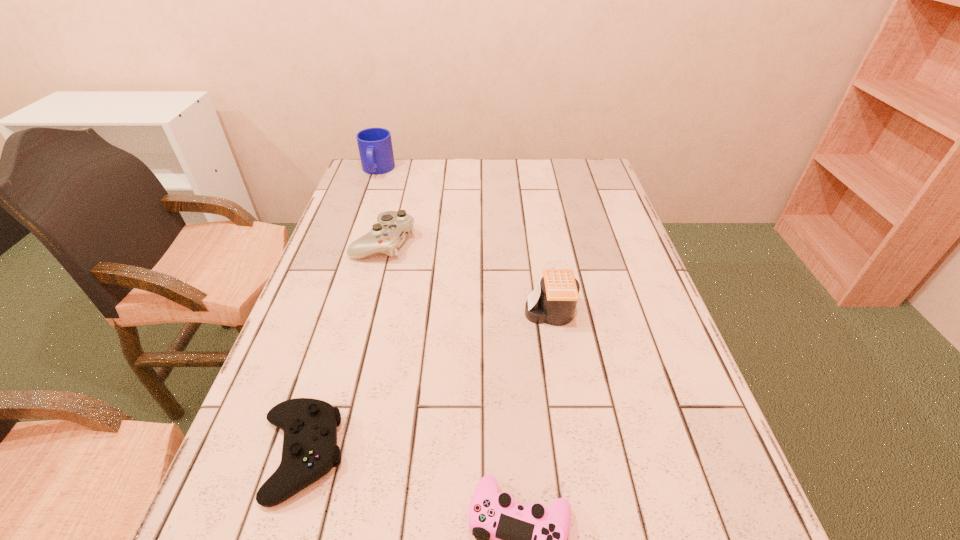
Find the location of a particular element. object that can be found as the closest to the tallest control is located at coordinates (375, 147).

Identify which control is the second nearest to the tallest object. Please provide its 2D coordinates. Your answer should be formatted as a tuple, i.e. [(x, y)], where the tuple contains the x and y coordinates of a point satisfying the conditions above.

[(310, 450)]

The image size is (960, 540). What are the coordinates of `control that stands as the closest to the farthest object` in the screenshot? It's located at (387, 235).

Image resolution: width=960 pixels, height=540 pixels. What are the coordinates of `blank space that satisfies the following two spatial constraints: 1. on the front side of the fourth nearest object; 2. on the left side of the calculator` in the screenshot? It's located at (366, 313).

At what (x,y) coordinates should I click in order to perform the action: click on free location that satisfies the following two spatial constraints: 1. on the side with the handle of the tallest control; 2. on the right side of the tallest object. Please return your answer as a coordinate pair (x, y). The height and width of the screenshot is (540, 960). Looking at the image, I should click on (352, 242).

Locate an element on the screen. The width and height of the screenshot is (960, 540). free location that satisfies the following two spatial constraints: 1. on the side with the handle of the farthest object; 2. on the right side of the calculator is located at coordinates (327, 313).